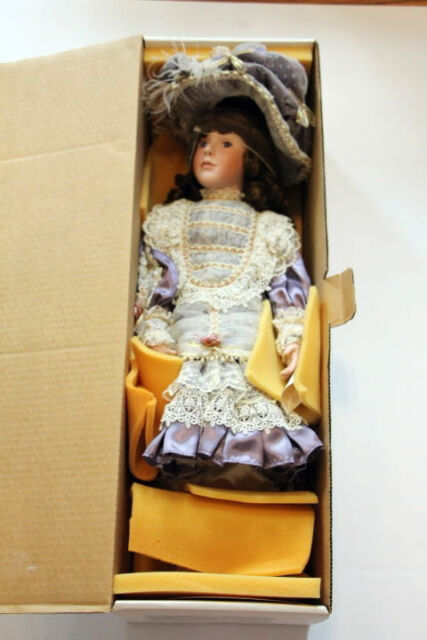
What are the coordinates of `doll` in the screenshot? It's located at (219, 148).